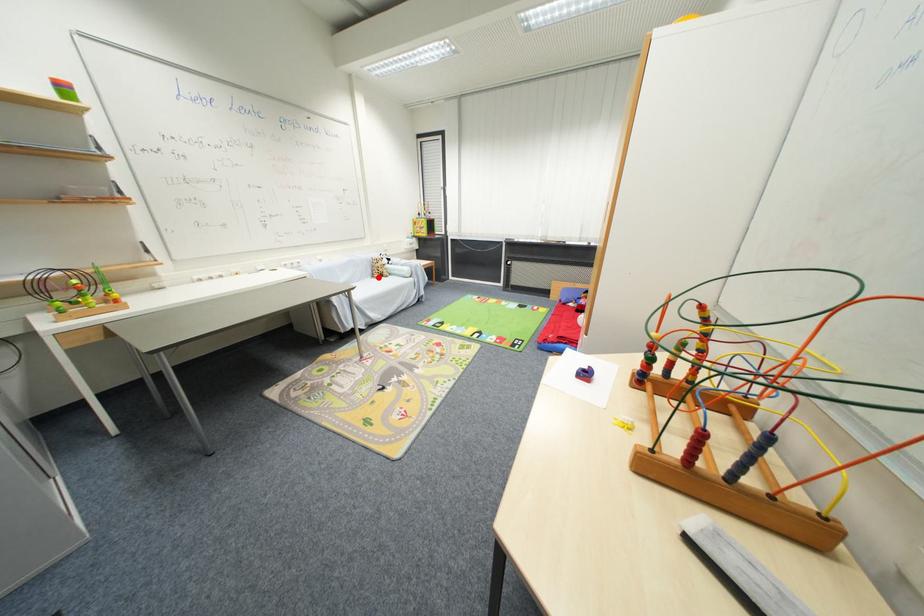
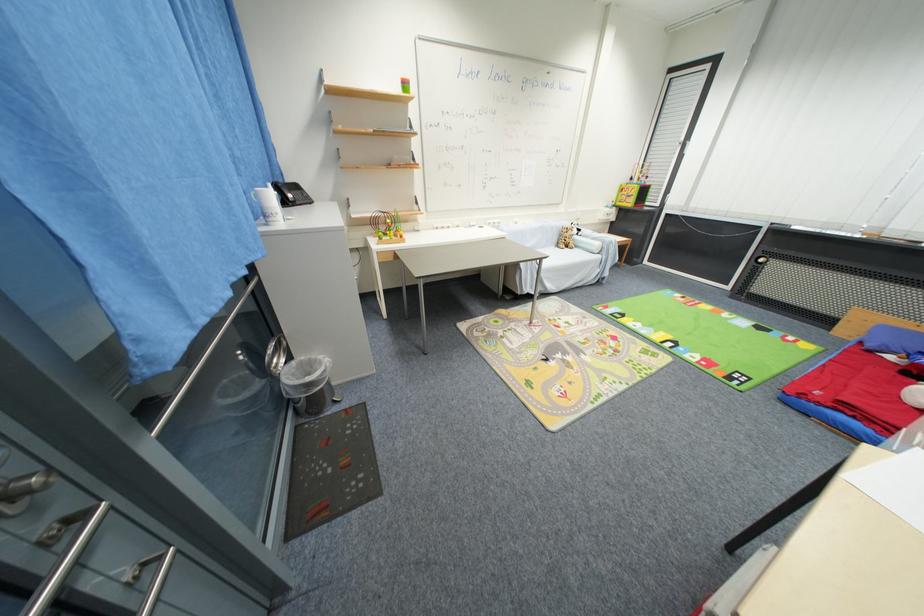
Question: A red point is marked in image1. In image2, is the corresponding 3D point closer to the camera or farther? Reply with the corresponding letter.

Choices:
 (A) The corresponding 3D point is closer.
 (B) The corresponding 3D point is farther.

Answer: (B)